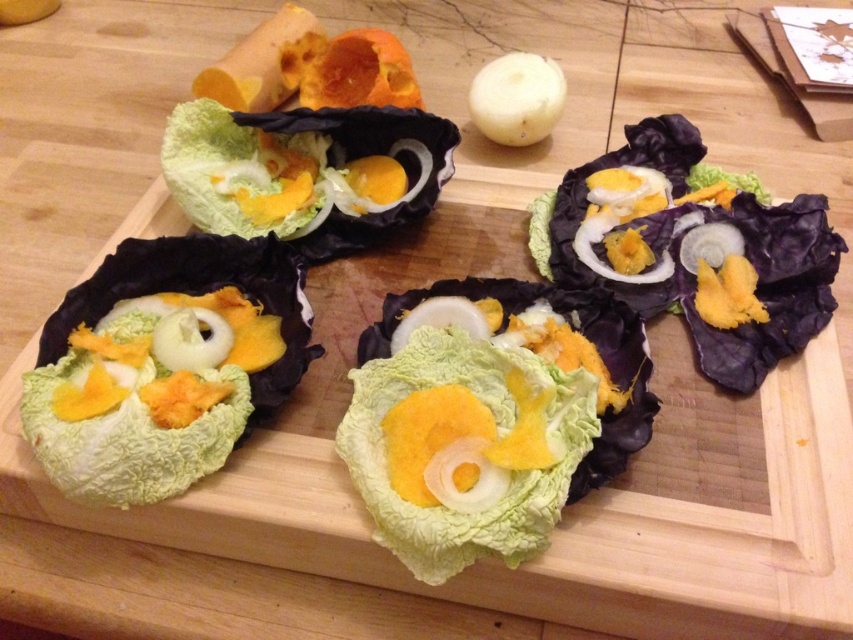
Is green leafy lettuce at center thinner than green leafy cabbage at upper left?

No.

Does green leafy lettuce at center appear on the right side of green leafy cabbage at upper left?

Indeed, green leafy lettuce at center is positioned on the right side of green leafy cabbage at upper left.

Between point (438, 364) and point (306, 216), which one is positioned in front?

Point (438, 364) is more forward.

This screenshot has width=853, height=640. Find the location of `green leafy lettuce at center`. green leafy lettuce at center is located at coordinates (500, 435).

Does point (766, 358) lie behind point (119, 316)?

No, it is not.

Can you confirm if purple matte cabbage leaf at upper right is wider than green leafy lettuce at lower left?

Correct, the width of purple matte cabbage leaf at upper right exceeds that of green leafy lettuce at lower left.

Identify the location of purple matte cabbage leaf at upper right. The height and width of the screenshot is (640, 853). (695, 252).

Image resolution: width=853 pixels, height=640 pixels. Find the location of `purple matte cabbage leaf at upper right`. purple matte cabbage leaf at upper right is located at coordinates (695, 252).

Between point (698, 240) and point (173, 176), which one is positioned behind?

The point (173, 176) is behind.

Does purple matte cabbage leaf at upper right have a smaller size compared to green leafy cabbage at upper left?

No, purple matte cabbage leaf at upper right is not smaller than green leafy cabbage at upper left.

You are a GUI agent. You are given a task and a screenshot of the screen. Output one action in this format:
    pyautogui.click(x=<x>, y=<y>)
    Task: Click on the purple matte cabbage leaf at upper right
    
    Given the screenshot: What is the action you would take?
    pyautogui.click(x=695, y=252)

The height and width of the screenshot is (640, 853). In order to click on purple matte cabbage leaf at upper right in this screenshot , I will do `click(695, 252)`.